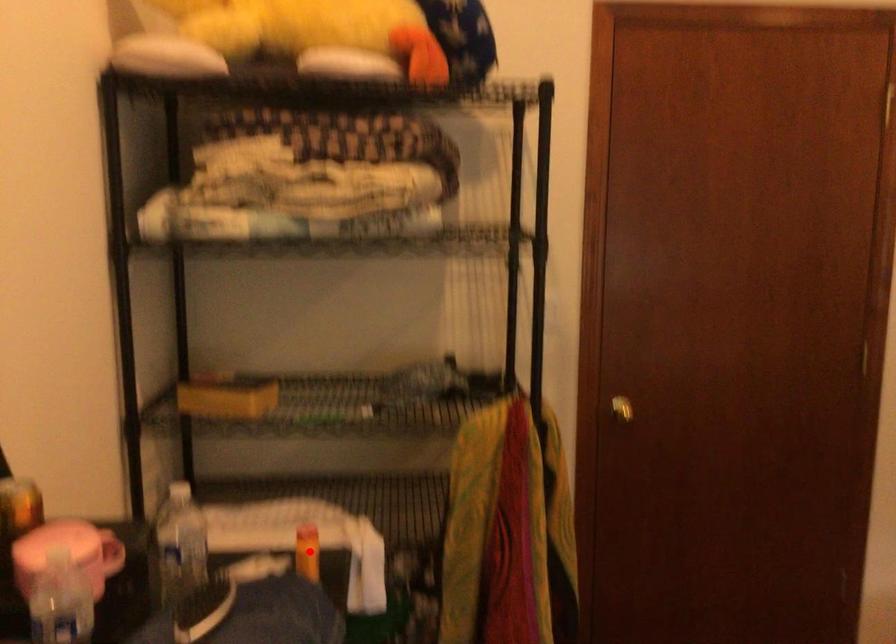
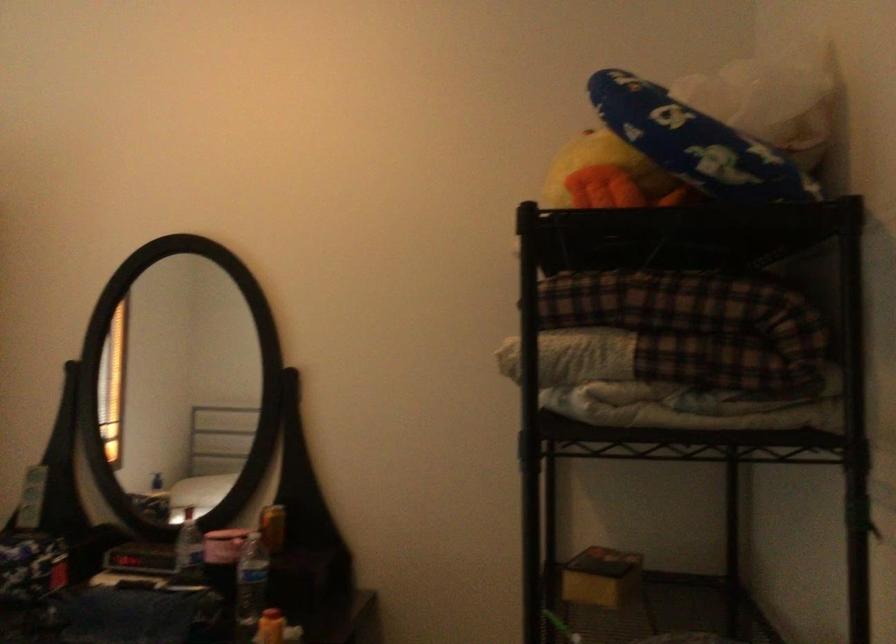
Question: A red point is marked in image1. In image2, is the corresponding 3D point closer to the camera or farther? Reply with the corresponding letter.

Choices:
 (A) The corresponding 3D point is closer.
 (B) The corresponding 3D point is farther.

Answer: (B)